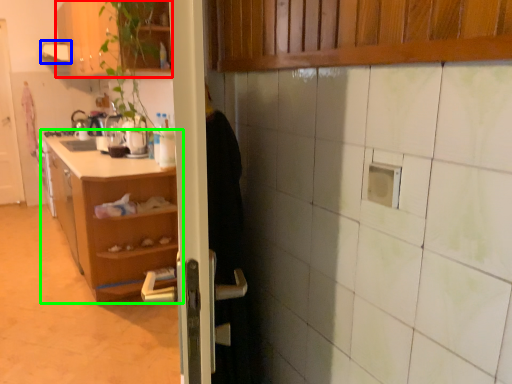
Question: Which object is the closest to the cabinetry (highlighted by a red box)? Choose among these: exhaust hood (highlighted by a blue box) or shelf (highlighted by a green box).

Choices:
 (A) exhaust hood
 (B) shelf

Answer: (A)